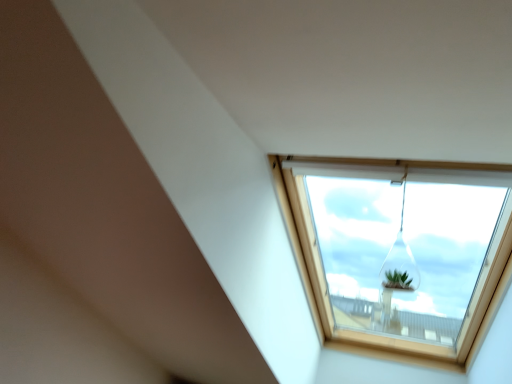
The width and height of the screenshot is (512, 384). Describe the element at coordinates (400, 259) in the screenshot. I see `transparent glass vase at upper center` at that location.

Locate an element on the screen. This screenshot has height=384, width=512. transparent glass vase at upper center is located at coordinates (400, 259).

The height and width of the screenshot is (384, 512). In order to click on transparent glass vase at upper center in this screenshot , I will do coord(400,259).